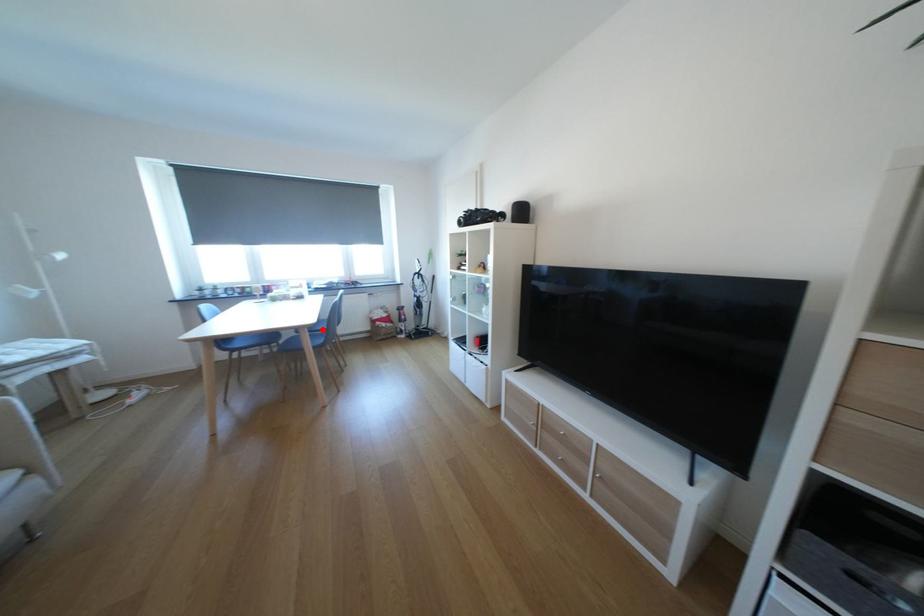
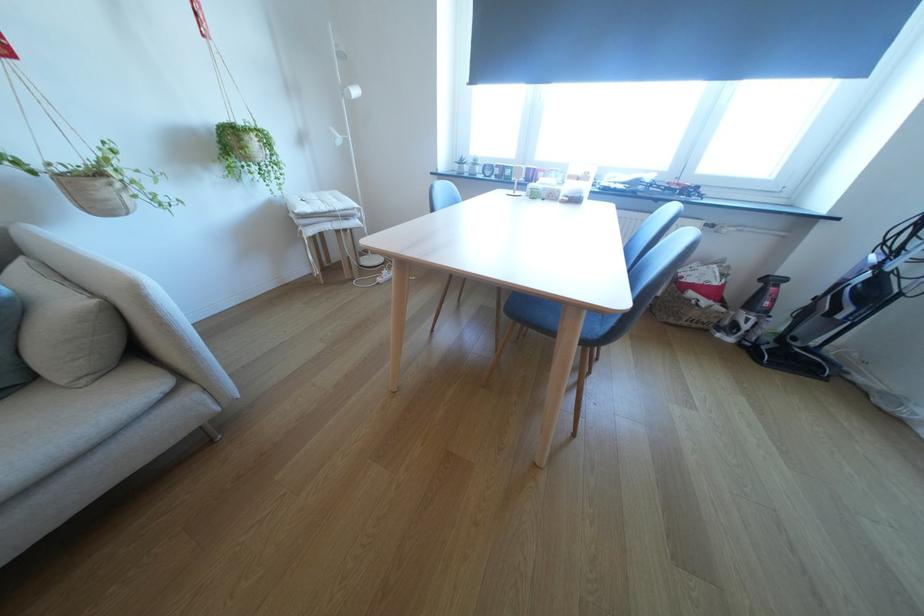
Question: I am providing you with two images of the same scene from different viewpoints. A red point is marked on the first image. Is the red point's position out of view in image 2?

Choices:
 (A) Yes
 (B) No

Answer: (A)